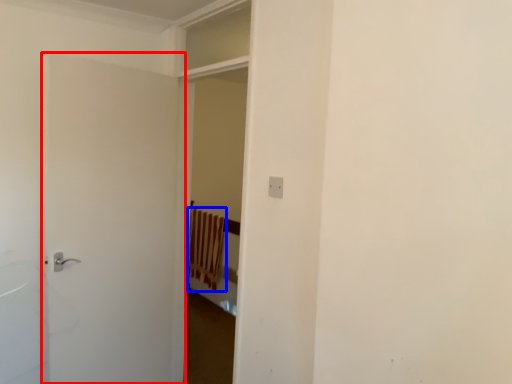
Question: Among these objects, which one is farthest to the camera, door (highlighted by a red box) or curtain (highlighted by a blue box)?

Choices:
 (A) door
 (B) curtain

Answer: (B)